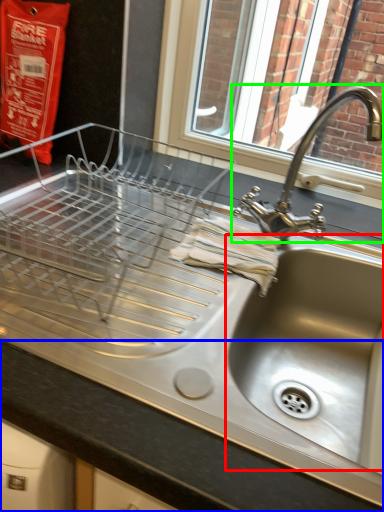
Question: Estimate the real-world distances between objects in this image. Which object is farther from sink (highlighted by a red box), counter top (highlighted by a blue box) or tap (highlighted by a green box)?

Choices:
 (A) counter top
 (B) tap

Answer: (A)